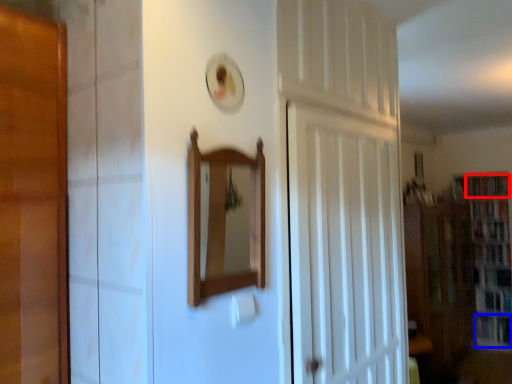
Question: Among these objects, which one is farthest to the camera, book (highlighted by a red box) or book (highlighted by a blue box)?

Choices:
 (A) book
 (B) book

Answer: (A)